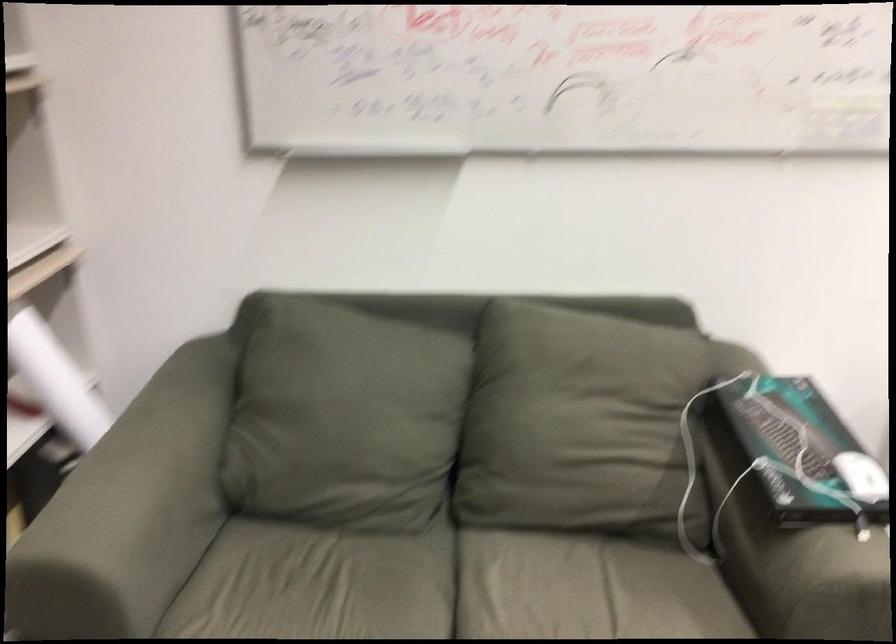
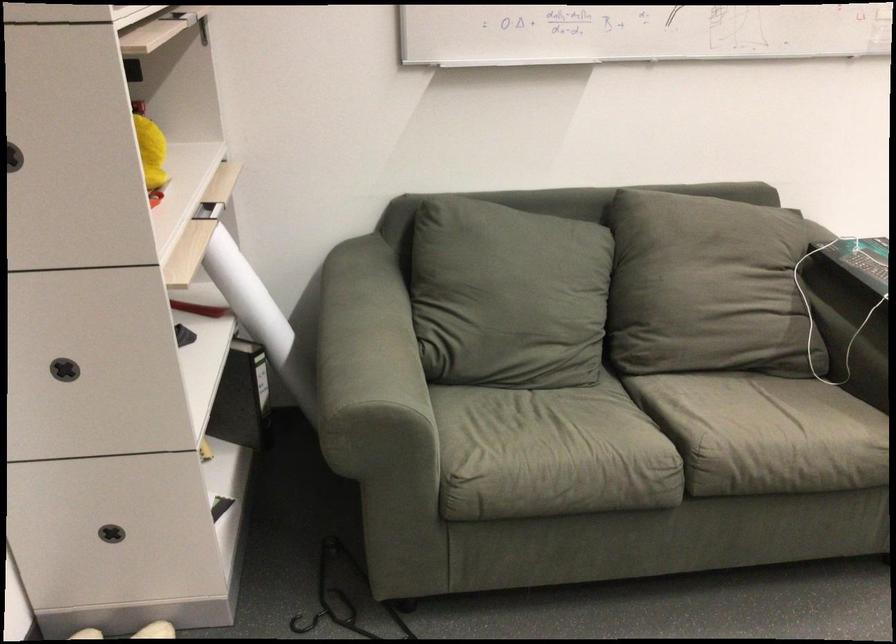
Find the pixel in the second image that matches (x=70, y=398) in the first image.

(247, 296)